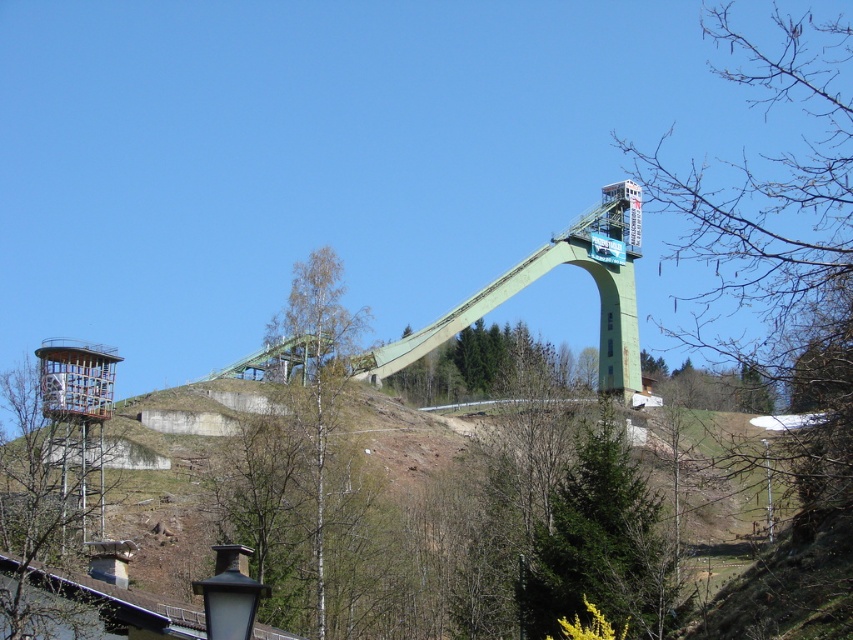
Question: Is bare branches at upper right thinner than green textured tree at lower center?

Choices:
 (A) no
 (B) yes

Answer: (A)

Question: Does bare branches at upper right appear on the left side of bare birch tree at center?

Choices:
 (A) yes
 (B) no

Answer: (B)

Question: Which object is the closest to the green wooden tower at left?

Choices:
 (A) green concrete ski jump at center
 (B) bare branches at upper right
 (C) bare birch tree at center

Answer: (C)

Question: Which point is farther from the camera taking this photo?

Choices:
 (A) (590, 552)
 (B) (71, 348)
 (C) (323, 452)

Answer: (C)

Question: Does green wooden tower at left lie in front of green textured tree at lower center?

Choices:
 (A) yes
 (B) no

Answer: (A)

Question: Which point appears farthest from the camera in this image?

Choices:
 (A) click(x=334, y=266)
 (B) click(x=576, y=560)

Answer: (A)